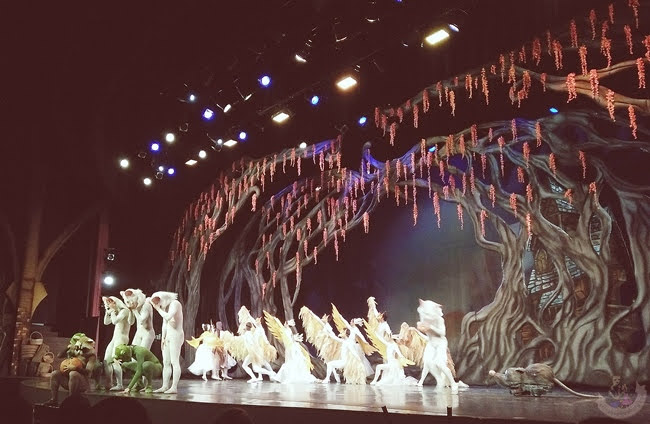
Identify the location of mouse decoration. (530, 382).